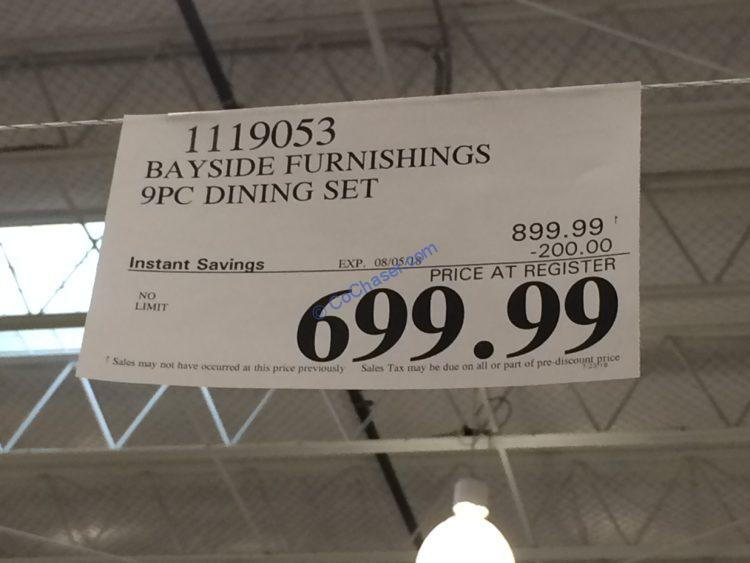
Find the location of a particular element. skylight is located at coordinates (40, 261).